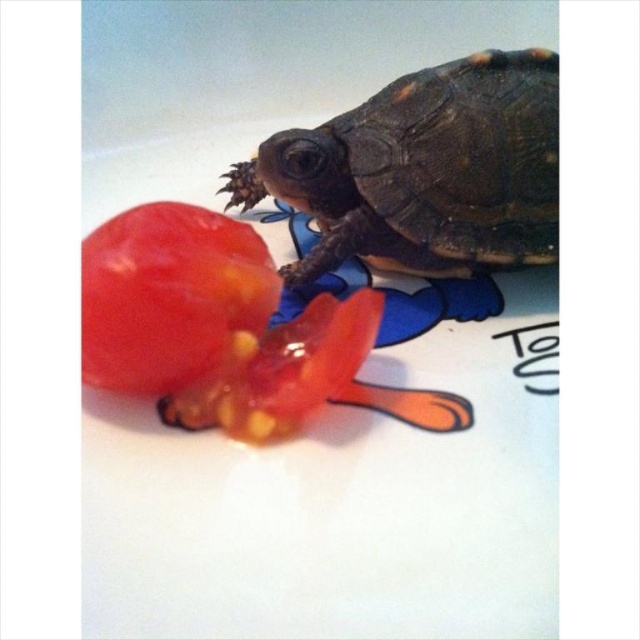
Question: From the image, what is the correct spatial relationship of smooth brown tortoise at upper right in relation to shiny red tomato at center?

Choices:
 (A) left
 (B) right

Answer: (B)

Question: Which point appears closest to the camera in this image?

Choices:
 (A) (332, 256)
 (B) (150, 275)

Answer: (B)

Question: Is smooth brown tortoise at upper right to the right of shiny red tomato at center from the viewer's perspective?

Choices:
 (A) no
 (B) yes

Answer: (B)

Question: Is smooth brown tortoise at upper right to the left of shiny red tomato at center from the viewer's perspective?

Choices:
 (A) yes
 (B) no

Answer: (B)

Question: Which of the following is the closest to the observer?

Choices:
 (A) (182, 252)
 (B) (362, 104)

Answer: (A)